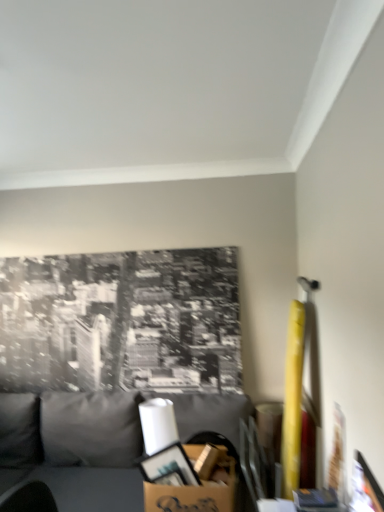
Question: From a real-world perspective, relative to cardboard box at lower center, is gray fabric couch at lower left vertically above or below?

Choices:
 (A) above
 (B) below

Answer: (B)

Question: Based on their positions, is gray fabric couch at lower left located to the left or right of cardboard box at lower center?

Choices:
 (A) right
 (B) left

Answer: (B)

Question: Looking at the image, does gray fabric couch at lower left seem bigger or smaller compared to cardboard box at lower center?

Choices:
 (A) small
 (B) big

Answer: (B)

Question: Is point (195, 509) positioned closer to the camera than point (34, 446)?

Choices:
 (A) farther
 (B) closer

Answer: (B)

Question: From a real-world perspective, relative to gray fabric couch at lower left, is cardboard box at lower center vertically above or below?

Choices:
 (A) above
 (B) below

Answer: (A)

Question: In terms of height, does cardboard box at lower center look taller or shorter compared to gray fabric couch at lower left?

Choices:
 (A) short
 (B) tall

Answer: (A)

Question: From the image's perspective, relative to gray fabric couch at lower left, is cardboard box at lower center above or below?

Choices:
 (A) above
 (B) below

Answer: (A)